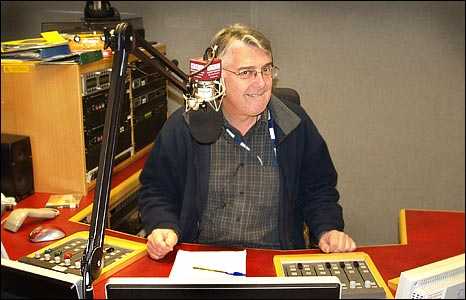
Find the location of a particular element. This screenshot has height=300, width=466. speaker is located at coordinates (18, 163).